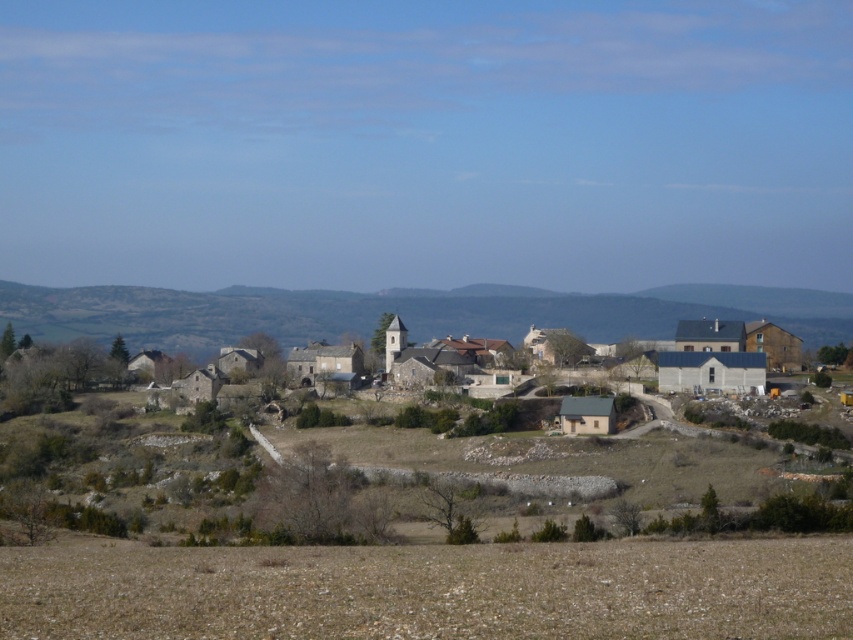
You are standing in the open field looking towards the village. Which object is closer to you, the brown grassland at lower center or the stone houses at center?

The brown grassland at lower center is closer to you because it is positioned in front of the stone houses at center.

You are standing in the open field looking towards the village. Which object is closer to you, the brown grassland at lower center or the stone houses at center?

The brown grassland at lower center is closer to you because it is positioned below the stone houses at center, meaning it is in a lower elevation or closer to the foreground.

You are a tourist visiting the village and want to take a photo that includes both the brown grassland at lower center and the stone houses at center. Which object should you focus on first to ensure both are in the frame?

The stone houses at center are larger than the brown grassland at lower center, so you should focus on the stone houses at center first to ensure both fit in the frame.